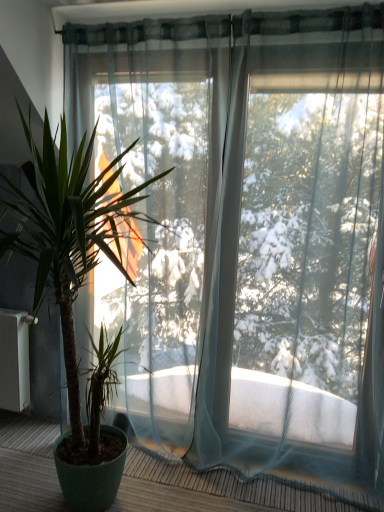
Question: Is green glossy plant at left wider or thinner than transparent fabric balcony at lower left?

Choices:
 (A) thin
 (B) wide

Answer: (B)

Question: Is green glossy plant at left bigger or smaller than transparent fabric balcony at lower left?

Choices:
 (A) small
 (B) big

Answer: (B)

Question: Visually, is green glossy plant at left positioned to the left or to the right of transparent fabric balcony at lower left?

Choices:
 (A) right
 (B) left

Answer: (B)

Question: From a real-world perspective, is transparent fabric balcony at lower left positioned above or below green glossy plant at left?

Choices:
 (A) above
 (B) below

Answer: (B)

Question: In terms of width, does transparent fabric balcony at lower left look wider or thinner when compared to green glossy plant at left?

Choices:
 (A) thin
 (B) wide

Answer: (A)

Question: Is point click(345, 501) positioned closer to the camera than point click(79, 182)?

Choices:
 (A) farther
 (B) closer

Answer: (A)

Question: From the image's perspective, relative to green glossy plant at left, is transparent fabric balcony at lower left above or below?

Choices:
 (A) above
 (B) below

Answer: (B)